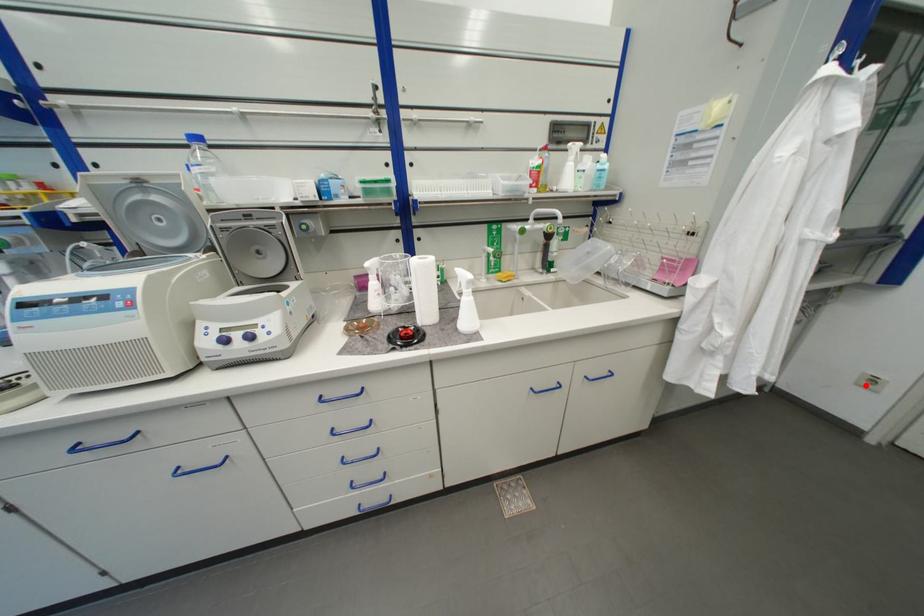
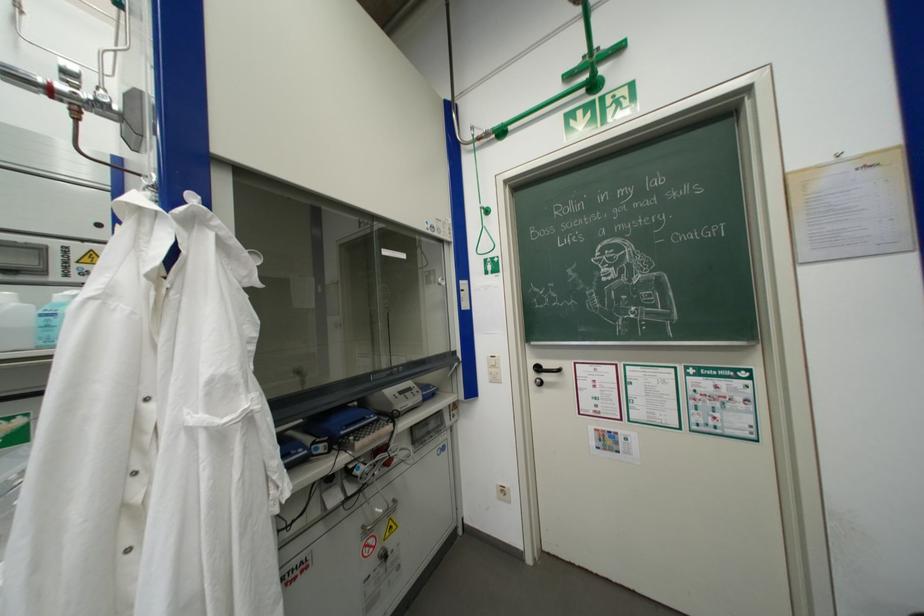
Question: I am providing you with two images of the same scene from different viewpoints. A red point is shown in image1. For the corresponding object point in image2, is it positioned nearer or farther from the camera?

Choices:
 (A) Nearer
 (B) Farther

Answer: (B)